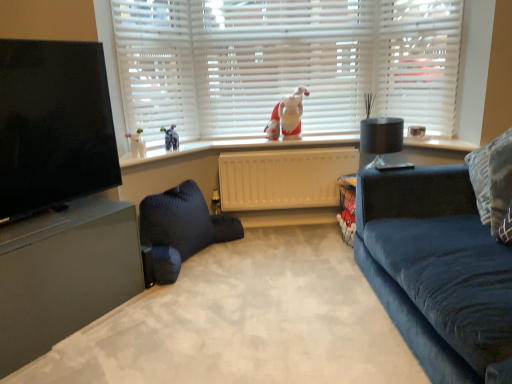
Identify the location of empty space that is to the right of dark blue knitted bean bag at center. (272, 258).